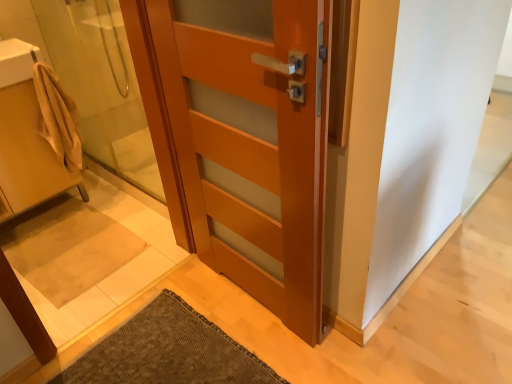
Identify the location of free space in front of beige fabric towel at left, the second sink positioned from the top. (48, 260).